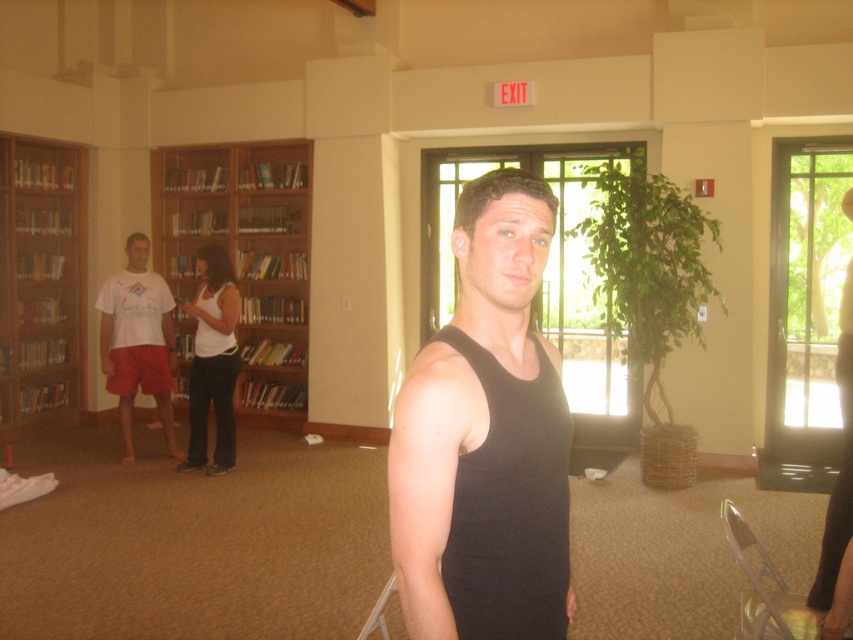
Question: Considering the real-world distances, which object is closest to the wooden bookcase at center?

Choices:
 (A) black matte tank top at center
 (B) white cotton t-shirt at left
 (C) wooden bookcase at left

Answer: (C)

Question: Is wooden bookcase at left closer to camera compared to white cotton t-shirt at left?

Choices:
 (A) yes
 (B) no

Answer: (B)

Question: Can you confirm if black matte tank top at center is bigger than wooden bookcase at center?

Choices:
 (A) yes
 (B) no

Answer: (B)

Question: Which point is closer to the camera?

Choices:
 (A) (456, 602)
 (B) (3, 374)
 (C) (99, 300)
 (D) (254, 205)

Answer: (A)

Question: Can you confirm if wooden bookcase at center is positioned above white cotton t-shirt at left?

Choices:
 (A) yes
 (B) no

Answer: (A)

Question: Which point is closer to the camera?

Choices:
 (A) black matte tank top at center
 (B) wooden bookcase at center

Answer: (A)